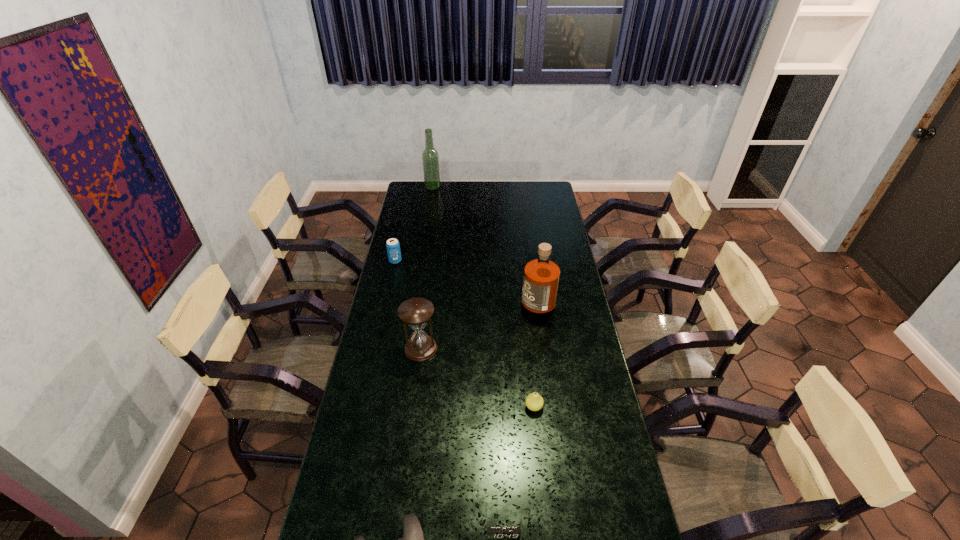
Identify the location of free space between the farthest object and the right liquor. (485, 243).

This screenshot has width=960, height=540. What are the coordinates of `unoccupied area between the farther liquor and the fourth nearest object` in the screenshot? It's located at (427, 268).

I want to click on free point between the right liquor and the fifth farthest object, so click(x=536, y=353).

Identify the location of unoccupied position between the leftmost object and the fifth farthest object. The height and width of the screenshot is (540, 960). click(x=465, y=334).

The image size is (960, 540). Identify the location of empty space that is in between the farthest object and the soda can. (414, 224).

Find the location of a particular element. This screenshot has width=960, height=540. vacant point located between the nearer liquor and the fifth object from left to right is located at coordinates (520, 416).

Identify which object is the sixth closest to the fifth shortest object. Please provide its 2D coordinates. Your answer should be formatted as a tuple, i.e. [(x, y)], where the tuple contains the x and y coordinates of a point satisfying the conditions above.

[(430, 158)]

At what (x,y) coordinates should I click in order to perform the action: click on object that is the third nearest to the third object from right to left. Please return your answer as a coordinate pair (x, y). The height and width of the screenshot is (540, 960). Looking at the image, I should click on (415, 312).